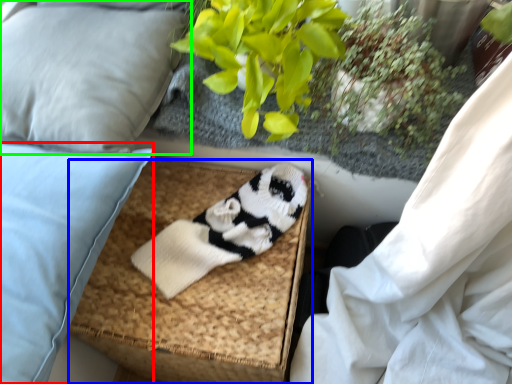
Question: Based on their relative distances, which object is nearer to pillow (highlighted by a red box)? Choose from footrest (highlighted by a blue box) and pillow (highlighted by a green box).

Choices:
 (A) footrest
 (B) pillow

Answer: (B)